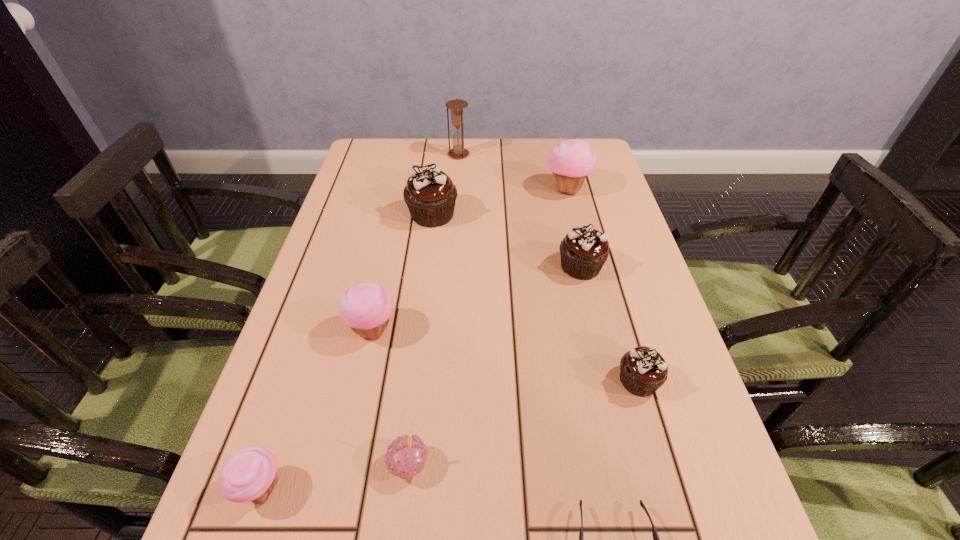
Identify the location of vacant point located 0.070m on the left of the second pink cupcake from right to left. (346, 465).

Identify the location of free point located 0.090m on the front of the fifth farthest cupcake. This screenshot has height=540, width=960. (659, 450).

Identify the location of free region located on the right of the leftmost cupcake. This screenshot has height=540, width=960. (348, 488).

This screenshot has width=960, height=540. In order to click on object situated at the far edge in this screenshot , I will do `click(457, 119)`.

The height and width of the screenshot is (540, 960). I want to click on free space at the far edge of the desktop, so click(x=537, y=153).

Locate an element on the screen. free region at the left edge of the desktop is located at coordinates (337, 281).

This screenshot has width=960, height=540. In order to click on free point at the right edge in this screenshot , I will do `click(624, 332)`.

This screenshot has height=540, width=960. Find the location of `vacant space at the far left corner of the desktop`. vacant space at the far left corner of the desktop is located at coordinates (406, 159).

This screenshot has width=960, height=540. What are the coordinates of `vacant space at the far right corner` in the screenshot? It's located at (594, 138).

The width and height of the screenshot is (960, 540). What are the coordinates of `empty space that is in between the farthest pink cupcake and the nearest brown cupcake` in the screenshot? It's located at click(x=603, y=285).